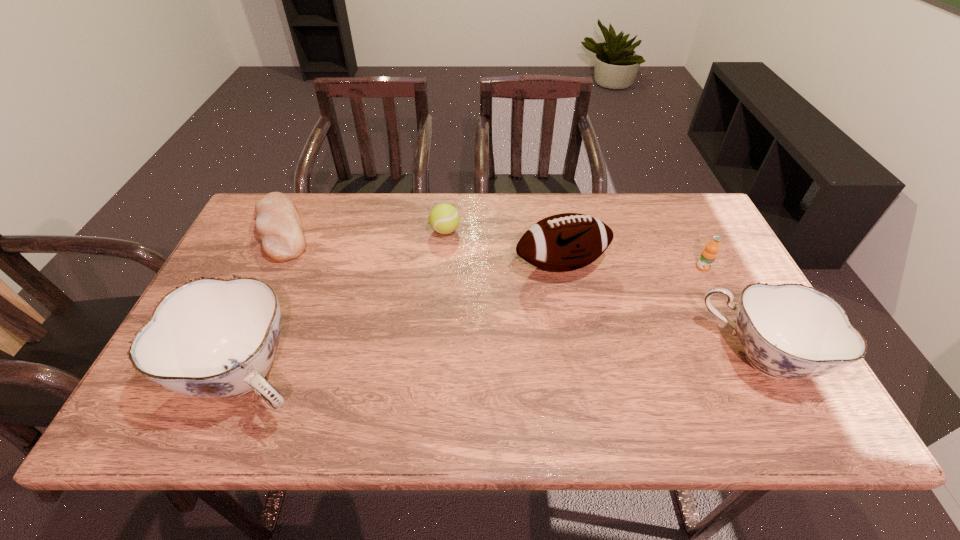
The image size is (960, 540). Find the location of `vacant space that satisfies the following two spatial constraints: 1. on the front side of the football (American); 2. on the right side of the fifth tallest object`. vacant space that satisfies the following two spatial constraints: 1. on the front side of the football (American); 2. on the right side of the fifth tallest object is located at coordinates (443, 265).

Image resolution: width=960 pixels, height=540 pixels. I want to click on vacant space that satisfies the following two spatial constraints: 1. on the front side of the bread; 2. on the right side of the right chinaware, so click(x=221, y=357).